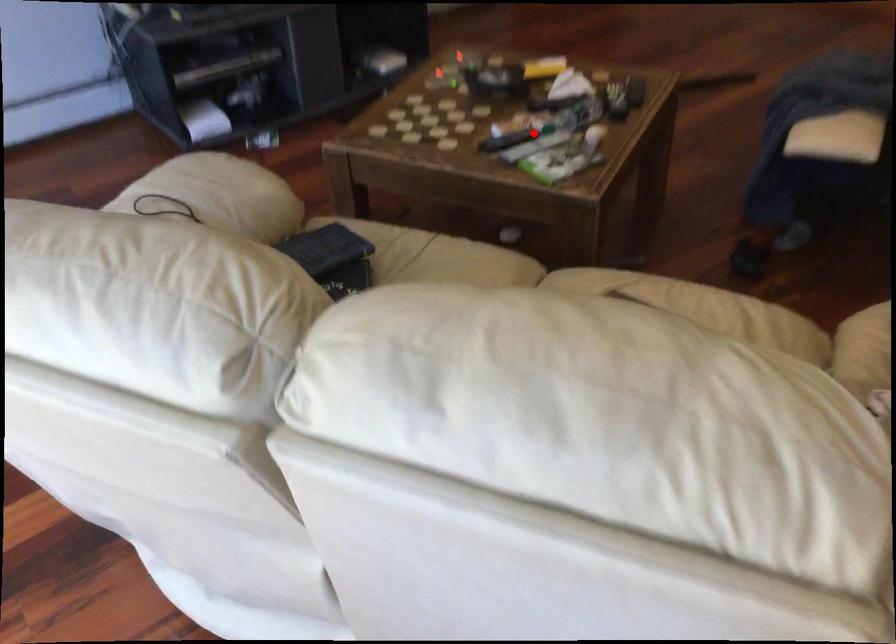
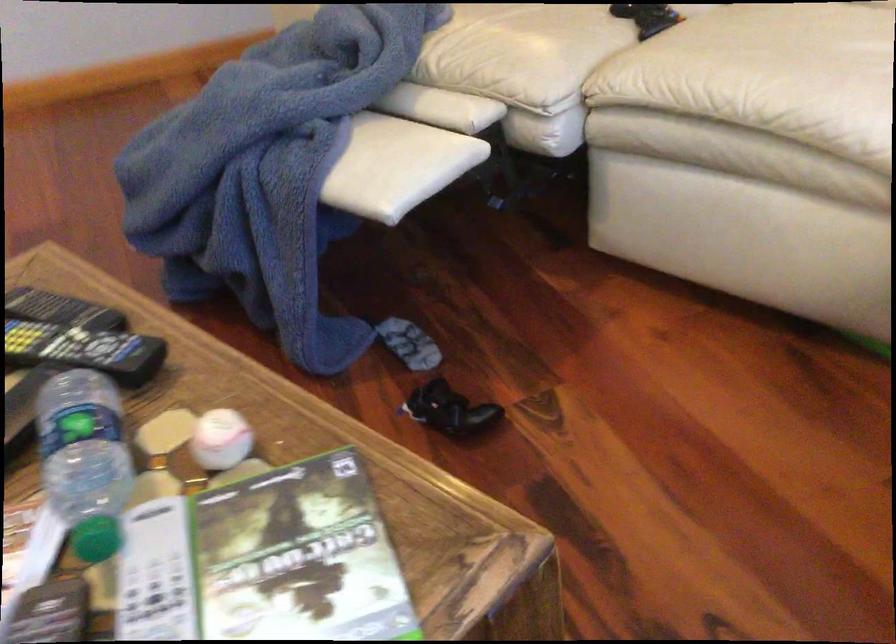
Question: I am providing you with two images of the same scene from different viewpoints. Given a red point in image1, look at the same physical point in image2. Is it:

Choices:
 (A) Closer to the viewpoint
 (B) Farther from the viewpoint

Answer: (A)